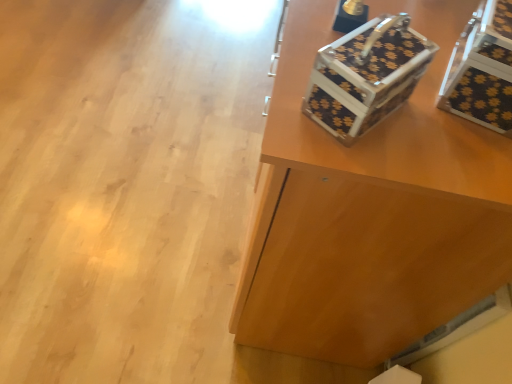
What are the coordinates of `black textured storage box at upper right` in the screenshot? It's located at (482, 69).

Which object is wider, metallic floral-patterned shoe box at upper right or black textured suitcase at upper right?

Wider between the two is black textured suitcase at upper right.

Is the position of metallic floral-patterned shoe box at upper right more distant than that of black textured suitcase at upper right?

That is False.

From the picture: Between metallic floral-patterned shoe box at upper right and black textured suitcase at upper right, which one has more height?

With more height is black textured suitcase at upper right.

Is metallic floral-patterned shoe box at upper right spatially inside black textured suitcase at upper right, or outside of it?

metallic floral-patterned shoe box at upper right is not enclosed by black textured suitcase at upper right.

Is black textured storage box at upper right completely or partially inside black textured suitcase at upper right?

Answer: No.

Which of these two, black textured suitcase at upper right or black textured storage box at upper right, is smaller?

With smaller size is black textured storage box at upper right.

Where is `storage box that appears below the black textured suitcase at upper right (from the image's perspective)`? Image resolution: width=512 pixels, height=384 pixels. storage box that appears below the black textured suitcase at upper right (from the image's perspective) is located at coordinates (482, 69).

Which object is thinner, black textured suitcase at upper right or black textured storage box at upper right?

black textured storage box at upper right.

This screenshot has height=384, width=512. I want to click on storage box on the right of metallic floral-patterned shoe box at upper right, so click(482, 69).

Which is closer, (511, 110) or (403, 30)?

Point (511, 110) is farther from the camera than point (403, 30).

Considering the relative sizes of black textured storage box at upper right and metallic floral-patterned shoe box at upper right in the image provided, is black textured storage box at upper right shorter than metallic floral-patterned shoe box at upper right?

No, black textured storage box at upper right is not shorter than metallic floral-patterned shoe box at upper right.

From the image's perspective, between black textured storage box at upper right and metallic floral-patterned shoe box at upper right, who is located below?

metallic floral-patterned shoe box at upper right is shown below in the image.

Would you say black textured suitcase at upper right is part of black textured storage box at upper right's contents?

That's incorrect, black textured suitcase at upper right is not inside black textured storage box at upper right.

Can you confirm if black textured storage box at upper right is bigger than black textured suitcase at upper right?

No.

This screenshot has width=512, height=384. Find the location of `storage box above the black textured suitcase at upper right (from a real-world perspective)`. storage box above the black textured suitcase at upper right (from a real-world perspective) is located at coordinates (482, 69).

Does black textured storage box at upper right touch black textured suitcase at upper right?

They are not placed beside each other.

From the picture: Which is more to the left, metallic floral-patterned shoe box at upper right or black textured storage box at upper right?

From the viewer's perspective, metallic floral-patterned shoe box at upper right appears more on the left side.

Is metallic floral-patterned shoe box at upper right situated inside black textured storage box at upper right or outside?

metallic floral-patterned shoe box at upper right is outside black textured storage box at upper right.

From the image's perspective, who appears lower, metallic floral-patterned shoe box at upper right or black textured storage box at upper right?

metallic floral-patterned shoe box at upper right appears lower in the image.

Is metallic floral-patterned shoe box at upper right oriented away from black textured storage box at upper right?

No, metallic floral-patterned shoe box at upper right's orientation is not away from black textured storage box at upper right.

Is black textured suitcase at upper right oriented towards metallic floral-patterned shoe box at upper right?

No, black textured suitcase at upper right does not turn towards metallic floral-patterned shoe box at upper right.

Considering the sizes of objects black textured suitcase at upper right and metallic floral-patterned shoe box at upper right in the image provided, who is thinner, black textured suitcase at upper right or metallic floral-patterned shoe box at upper right?

With smaller width is metallic floral-patterned shoe box at upper right.

Between black textured suitcase at upper right and metallic floral-patterned shoe box at upper right, which one appears on the left side from the viewer's perspective?

From the viewer's perspective, metallic floral-patterned shoe box at upper right appears more on the left side.

Between black textured suitcase at upper right and metallic floral-patterned shoe box at upper right, which one has larger size?

With larger size is black textured suitcase at upper right.

Locate an element on the screen. Image resolution: width=512 pixels, height=384 pixels. shoe box above the black textured suitcase at upper right (from a real-world perspective) is located at coordinates (366, 75).

At what (x,y) coordinates should I click in order to perform the action: click on storage box that appears below the black textured suitcase at upper right (from the image's perspective). Please return your answer as a coordinate pair (x, y). This screenshot has width=512, height=384. Looking at the image, I should click on (482, 69).

Estimate the real-world distances between objects in this image. Which object is closer to black textured storage box at upper right, metallic floral-patterned shoe box at upper right or black textured suitcase at upper right?

metallic floral-patterned shoe box at upper right is closer to black textured storage box at upper right.

Estimate the real-world distances between objects in this image. Which object is closer to black textured suitcase at upper right, black textured storage box at upper right or metallic floral-patterned shoe box at upper right?

metallic floral-patterned shoe box at upper right is closer to black textured suitcase at upper right.

Looking at the image, which one is located further to metallic floral-patterned shoe box at upper right, black textured suitcase at upper right or black textured storage box at upper right?

black textured suitcase at upper right lies further to metallic floral-patterned shoe box at upper right than the other object.

Estimate the real-world distances between objects in this image. Which object is closer to metallic floral-patterned shoe box at upper right, black textured storage box at upper right or black textured suitcase at upper right?

black textured storage box at upper right is positioned closer to the anchor metallic floral-patterned shoe box at upper right.

In the scene shown: Based on their spatial positions, is metallic floral-patterned shoe box at upper right or black textured storage box at upper right closer to black textured suitcase at upper right?

Among the two, metallic floral-patterned shoe box at upper right is located nearer to black textured suitcase at upper right.

Which object lies further to the anchor point black textured storage box at upper right, black textured suitcase at upper right or metallic floral-patterned shoe box at upper right?

black textured suitcase at upper right is positioned further to the anchor black textured storage box at upper right.

Where is `storage box between black textured suitcase at upper right and metallic floral-patterned shoe box at upper right from top to bottom`? storage box between black textured suitcase at upper right and metallic floral-patterned shoe box at upper right from top to bottom is located at coordinates (482, 69).